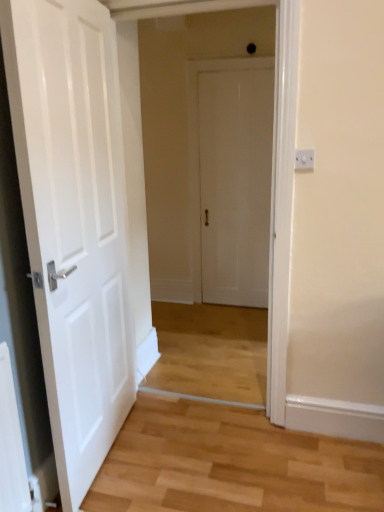
Where is `vacant area that is situated to the right of white matte door at center, placed as the second door when sorted from back to front`? vacant area that is situated to the right of white matte door at center, placed as the second door when sorted from back to front is located at coordinates (192, 453).